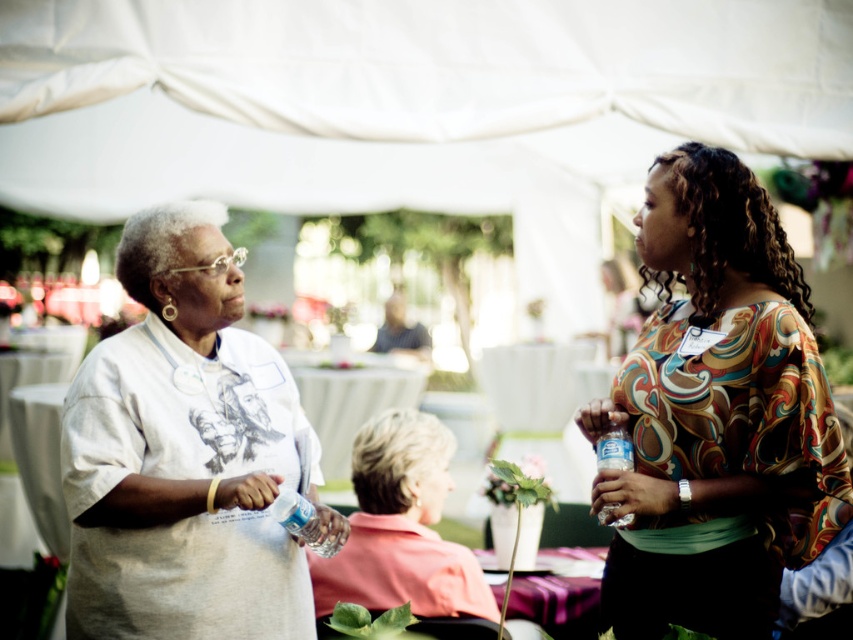
Does light gray cotton shirt at left come behind clear plastic bottle at right?

That is False.

What do you see at coordinates (183, 452) in the screenshot?
I see `light gray cotton shirt at left` at bounding box center [183, 452].

Which is behind, point (260, 513) or point (602, 468)?

The point (260, 513) is behind.

At what (x,y) coordinates should I click in order to perform the action: click on light gray cotton shirt at left. Please return your answer as a coordinate pair (x, y). Image resolution: width=853 pixels, height=640 pixels. Looking at the image, I should click on (183, 452).

Looking at this image, can you confirm if matte floral blouse at center is positioned above light gray cotton shirt at left?

Indeed, matte floral blouse at center is positioned over light gray cotton shirt at left.

Who is more distant from viewer, (824, 492) or (120, 417)?

The point (120, 417) is behind.

Locate an element on the screen. The height and width of the screenshot is (640, 853). matte floral blouse at center is located at coordinates (717, 412).

Where is `matte floral blouse at center`? This screenshot has height=640, width=853. matte floral blouse at center is located at coordinates (717, 412).

Consider the image. Who is positioned more to the right, light gray cotton shirt at left or clear plastic bottle at center?

clear plastic bottle at center

Between point (196, 412) and point (293, 513), which one is positioned in front?

Point (196, 412)

The height and width of the screenshot is (640, 853). I want to click on light gray cotton shirt at left, so click(x=183, y=452).